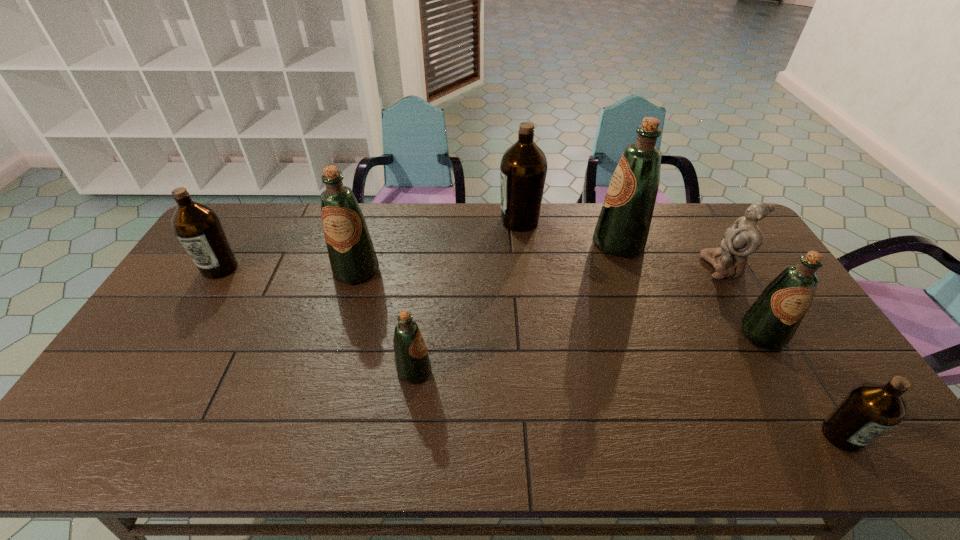
Locate an element on the screen. empty location between the leftmost object and the second object from left to right is located at coordinates (288, 269).

This screenshot has height=540, width=960. What are the coordinates of `object that stands as the closest to the smallest brown olive oil` in the screenshot? It's located at (770, 323).

The image size is (960, 540). In order to click on object that is the second closest to the third smallest green olive oil in this screenshot , I will do `click(197, 226)`.

Locate which olive oil is the closest to the second object from left to right. Please provide its 2D coordinates. Your answer should be formatted as a tuple, i.e. [(x, y)], where the tuple contains the x and y coordinates of a point satisfying the conditions above.

[(412, 362)]

Identify which olive oil is located as the fourth nearest to the biggest brown olive oil. Please provide its 2D coordinates. Your answer should be formatted as a tuple, i.e. [(x, y)], where the tuple contains the x and y coordinates of a point satisfying the conditions above.

[(770, 323)]

Locate an element on the screen. The width and height of the screenshot is (960, 540). green olive oil that stands as the fourth closest to the biggest brown olive oil is located at coordinates (770, 323).

Image resolution: width=960 pixels, height=540 pixels. What are the coordinates of `the third closest green olive oil to the second biggest green olive oil` in the screenshot? It's located at (770, 323).

Locate which brown olive oil ranks in proximity to the second biggest brown olive oil. Please provide its 2D coordinates. Your answer should be formatted as a tuple, i.e. [(x, y)], where the tuple contains the x and y coordinates of a point satisfying the conditions above.

[(523, 168)]

Select which brown olive oil appears as the second closest to the biggest brown olive oil. Please provide its 2D coordinates. Your answer should be formatted as a tuple, i.e. [(x, y)], where the tuple contains the x and y coordinates of a point satisfying the conditions above.

[(870, 409)]

Image resolution: width=960 pixels, height=540 pixels. Identify the location of blank area in the image that satisfies the following two spatial constraints: 1. on the front-facing side of the figurine; 2. on the label of the leftmost olive oil. (725, 268).